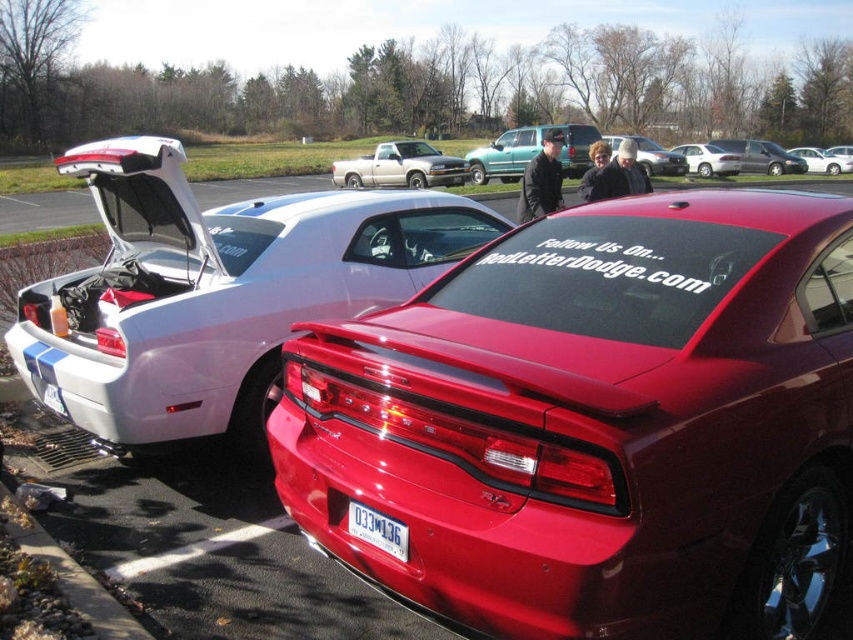
Question: Estimate the real-world distances between objects in this image. Which object is closer to the white plastic license plate at center?

Choices:
 (A) metallic silver sedan at center
 (B) white glossy car at center

Answer: (B)

Question: Which object appears closest to the camera in this image?

Choices:
 (A) matte black car at center
 (B) white glossy car at left

Answer: (B)

Question: Among these points, which one is nearest to the camera?

Choices:
 (A) (120, 216)
 (B) (360, 529)

Answer: (B)

Question: Does shiny red car at center have a larger size compared to teal matte van at center?

Choices:
 (A) yes
 (B) no

Answer: (B)

Question: Is metallic silver truck at center closer to camera compared to matte black car at center?

Choices:
 (A) yes
 (B) no

Answer: (B)

Question: Is white glossy car at center below matte black car at center?

Choices:
 (A) yes
 (B) no

Answer: (A)